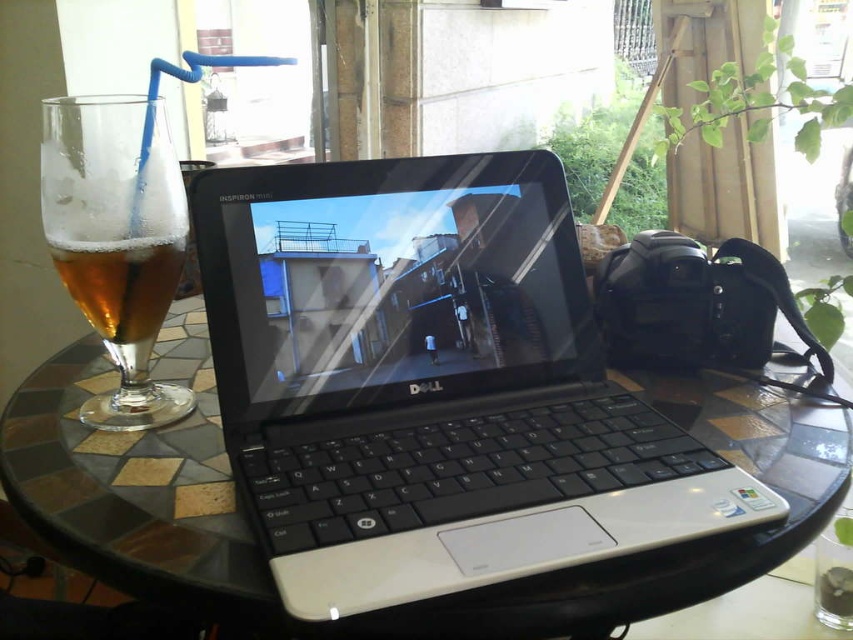
You are standing in the cafe and want to place a small sticker on the table between the two points labeled point (448, 378) and point (137, 392). Which point should you place the sticker closer to so that it appears larger in your view?

You should place the sticker closer to point (448, 378) because it is closer to the camera, making objects placed there appear larger in your view.

Where is the black plastic laptop at center located in the image?

The black plastic laptop at center is located at point (x=431, y=385) in the image.

You are a customer at the cafe and want to place your phone on the table without spilling your drink. Where should you place it relative to the black plastic laptop at center and the amber glass at left?

The black plastic laptop at center is in front of the amber glass at left, so placing the phone behind the laptop would keep it away from the drink and prevent spills.